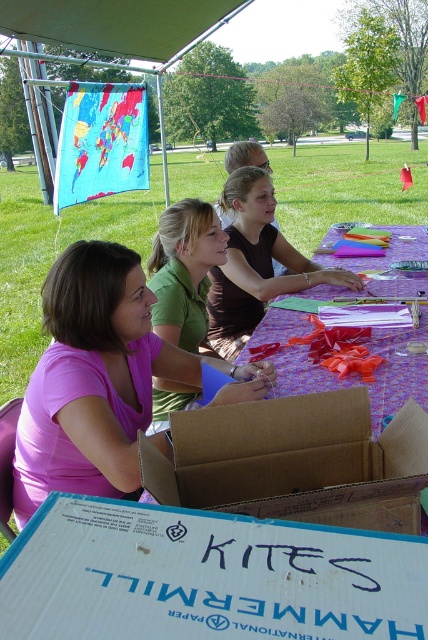
Question: Considering the relative positions of cardboard box at center and green matte shirt at center in the image provided, where is cardboard box at center located with respect to green matte shirt at center?

Choices:
 (A) above
 (B) below

Answer: (B)

Question: Observing the image, what is the correct spatial positioning of multicolored paper at center in reference to green matte shirt at center?

Choices:
 (A) below
 (B) above

Answer: (B)

Question: Among these objects, which one is farthest from the camera?

Choices:
 (A) cardboard box at center
 (B) matte brown shirt at center
 (C) pink matte shirt at center
 (D) green matte shirt at center

Answer: (B)

Question: Considering the real-world distances, which object is farthest from the pink matte shirt at center?

Choices:
 (A) cardboard box at center
 (B) green matte shirt at center
 (C) multicolored paper at center

Answer: (C)

Question: Can you confirm if pink matte shirt at center is positioned below green matte shirt at center?

Choices:
 (A) yes
 (B) no

Answer: (A)

Question: Which object is closer to the camera taking this photo?

Choices:
 (A) cardboard box at center
 (B) multicolored paper at center
 (C) pink matte shirt at center

Answer: (A)